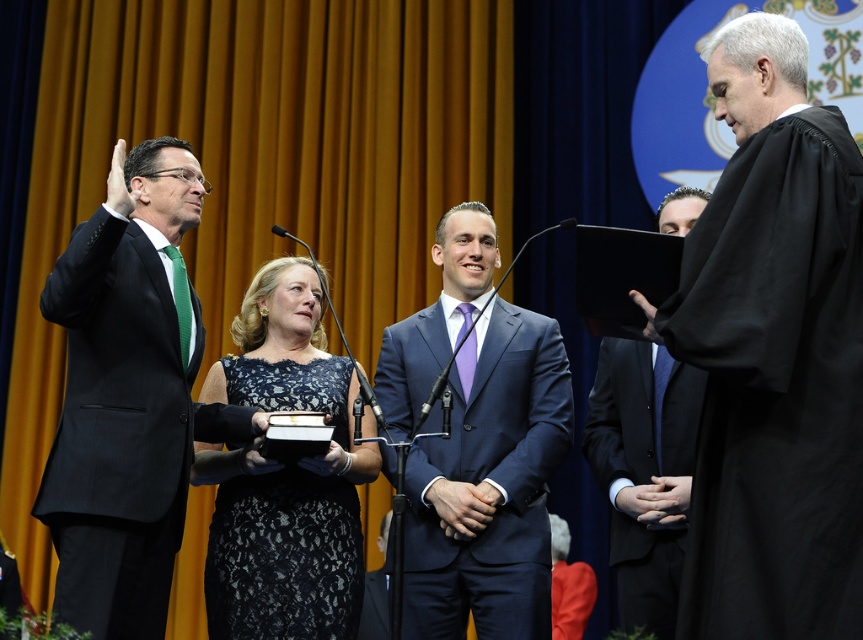
Is shiny blue suit at center thinner than black pinstripe suit at left?

No, shiny blue suit at center is not thinner than black pinstripe suit at left.

Does point (496, 304) come in front of point (131, 278)?

No, it is not.

Locate an element on the screen. shiny blue suit at center is located at coordinates (489, 486).

This screenshot has width=863, height=640. What do you see at coordinates (118, 429) in the screenshot? I see `black pinstripe suit at left` at bounding box center [118, 429].

Can you confirm if black pinstripe suit at left is bigger than black matte suit at right?

Correct, black pinstripe suit at left is larger in size than black matte suit at right.

Locate an element on the screen. The width and height of the screenshot is (863, 640). black pinstripe suit at left is located at coordinates (118, 429).

Image resolution: width=863 pixels, height=640 pixels. Describe the element at coordinates (118, 429) in the screenshot. I see `black pinstripe suit at left` at that location.

Can you confirm if black pinstripe suit at left is positioned above lace dress at center?

Indeed, black pinstripe suit at left is positioned over lace dress at center.

Image resolution: width=863 pixels, height=640 pixels. What are the coordinates of `black pinstripe suit at left` in the screenshot? It's located at (118, 429).